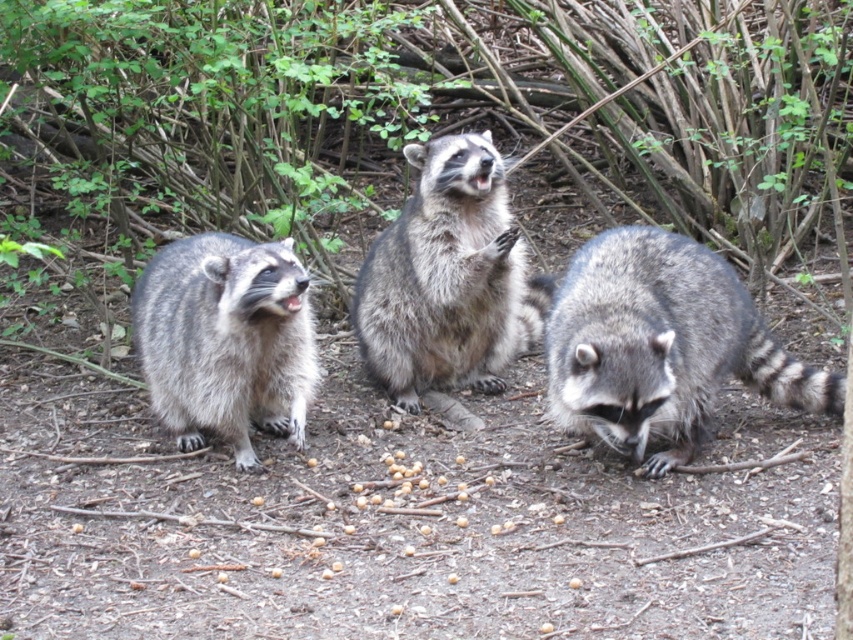
Is point (619, 436) positioned behind point (473, 368)?

That is False.

Does gray fur raccoon at lower right appear on the right side of fuzzy gray raccoon at center?

Yes, gray fur raccoon at lower right is to the right of fuzzy gray raccoon at center.

In order to click on gray fur raccoon at lower right in this screenshot , I will do `click(660, 346)`.

Does fuzzy gray raccoon at center have a lesser width compared to gray fur raccoon at left?

No.

Looking at this image, can you confirm if fuzzy gray raccoon at center is wider than gray fur raccoon at left?

Indeed, fuzzy gray raccoon at center has a greater width compared to gray fur raccoon at left.

The image size is (853, 640). Find the location of `fuzzy gray raccoon at center`. fuzzy gray raccoon at center is located at coordinates (448, 282).

Is gray fur raccoon at lower right positioned in front of gray fur raccoon at left?

Yes, gray fur raccoon at lower right is in front of gray fur raccoon at left.

Is gray fur raccoon at lower right smaller than gray fur raccoon at left?

Actually, gray fur raccoon at lower right might be larger than gray fur raccoon at left.

Does point (763, 349) lie in front of point (305, 348)?

That is False.

Locate an element on the screen. The image size is (853, 640). gray fur raccoon at lower right is located at coordinates (660, 346).